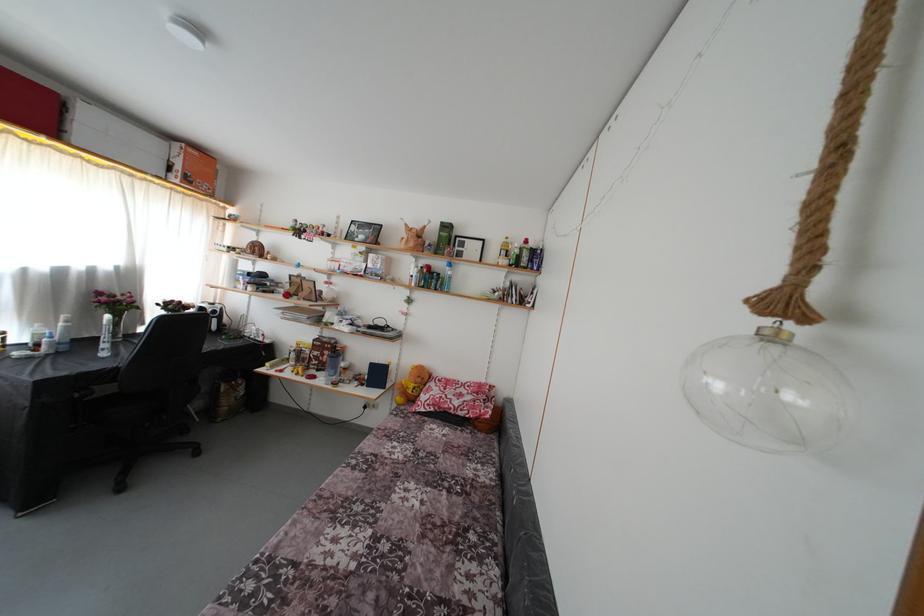
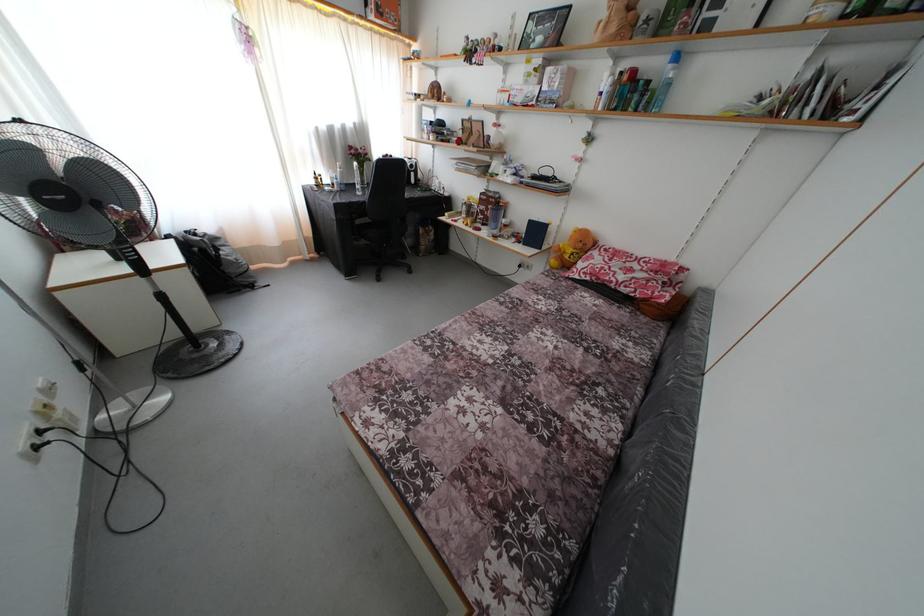
In the second image, find the point that corresponds to the point at 424,386 in the first image.

(585, 251)